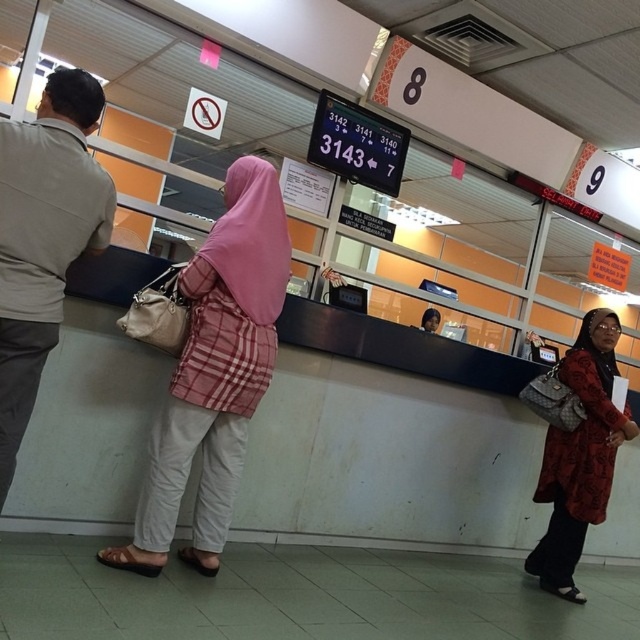
You are a visitor at the service counter and need to hand over a form to the clerk. You notice two items near the counter. Which item is closer to you between the pink fabric hijab at center and the red textured coat at lower right?

The pink fabric hijab at center is closer to the viewer than the red textured coat at lower right, so the pink fabric hijab at center is closer to you.

You are a visitor at the service counter and need to reach the two points marked in the image. Which point, point [115,547] or point [49,182], is closer to you?

Point [115,547] is closer to you because it is further to the viewer than point [49,182].

You are standing at the entrance of the service center and need to locate the pink fabric hijab at center. According to the coordinates provided, where exactly is the pink fabric hijab positioned in the image?

The pink fabric hijab at center is located at point coordinates of 0.583 on the x axis and 0.338 on the y axis.